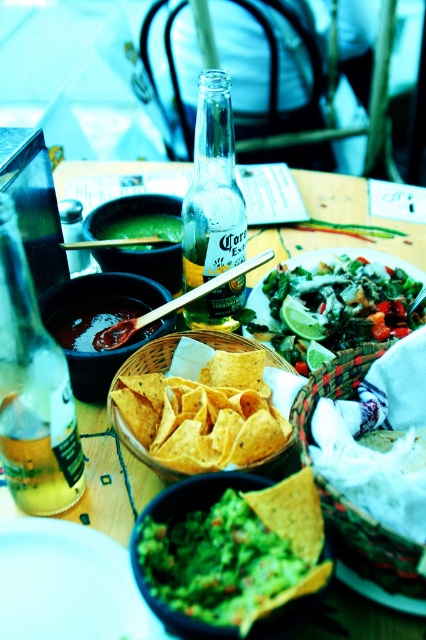
You are a customer at this table and want to reach the braided straw basket at center. Based on the coordinates provided in the Objects Description, is the basket closer to the edge of the table or near the center?

The braided straw basket at center is located at point coordinates of (371, 545). Since both coordinates are close to 1, this indicates the basket is near the edge of the table rather than the center.

You are a server at a restaurant and need to place both the translucent glass bottle at center and the green matte lime at center on a shelf. The shelf has limited space and can only accommodate one of them. Which object should you choose to fit on the shelf?

The green matte lime at center should be placed on the shelf because it is smaller than the translucent glass bottle at center, making it more likely to fit within the limited space.

You are a customer at this Mexican restaurant table. You want to grab the green matte lime at center to squeeze into your drink. However, there is a translucent glass bottle at center in the way. Can you reach the lime without moving the bottle?

The translucent glass bottle at center is in front of the green matte lime at center, so you cannot reach the lime without moving the bottle.